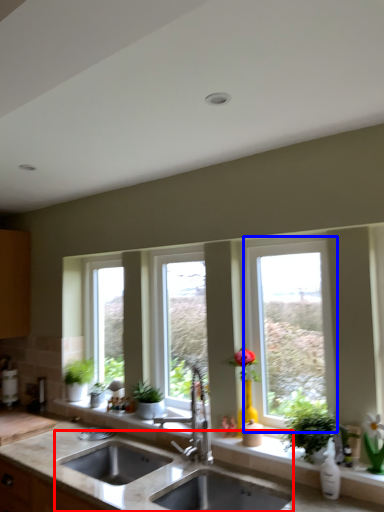
Question: Which object is further to the camera taking this photo, sink (highlighted by a red box) or window (highlighted by a blue box)?

Choices:
 (A) sink
 (B) window

Answer: (B)